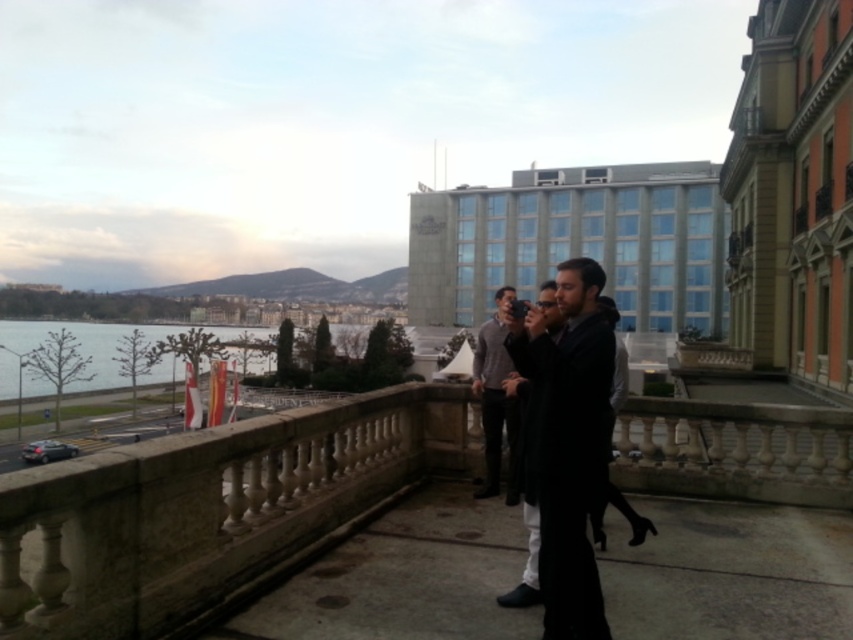
Question: Considering the real-world distances, which object is farthest from the dark gray coat at center?

Choices:
 (A) blue water at lower left
 (B) black leather dress at center

Answer: (A)

Question: Based on their relative distances, which object is farther from the dark gray coat at center?

Choices:
 (A) black leather dress at center
 (B) concrete pavement at center
 (C) gray sweater at center

Answer: (B)

Question: Where is concrete pavement at center located in relation to black fabric coat at center in the image?

Choices:
 (A) below
 (B) above

Answer: (A)

Question: Is blue water at lower left positioned in front of gray sweater at center?

Choices:
 (A) yes
 (B) no

Answer: (B)

Question: Does concrete pavement at center have a lesser width compared to blue water at lower left?

Choices:
 (A) yes
 (B) no

Answer: (A)

Question: Which object is closer to the camera taking this photo?

Choices:
 (A) gray sweater at center
 (B) dark gray coat at center

Answer: (B)